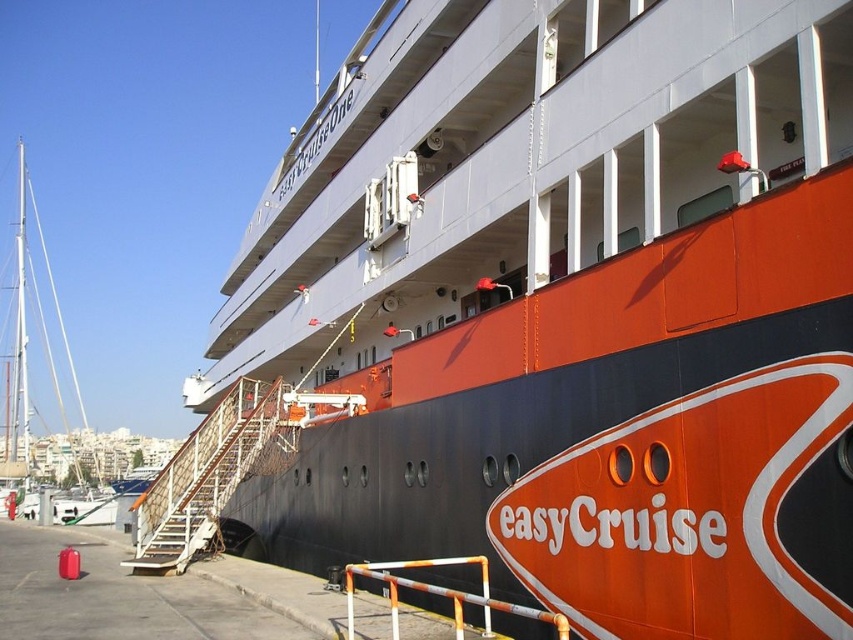
Question: Is white glossy sailboat at left closer to camera compared to orange/white metal railing at lower center?

Choices:
 (A) yes
 (B) no

Answer: (B)

Question: Estimate the real-world distances between objects in this image. Which object is farther from the white glossy sailboat at left?

Choices:
 (A) metallic stair rail at center
 (B) orange/white metal railing at lower center

Answer: (B)

Question: Which is nearer to the metallic stair rail at center?

Choices:
 (A) orange/white metal railing at lower center
 (B) white glossy sailboat at left

Answer: (A)

Question: Does metallic stair rail at center appear on the left side of orange/white metal railing at lower center?

Choices:
 (A) yes
 (B) no

Answer: (A)

Question: Which object is the farthest from the metallic stair rail at center?

Choices:
 (A) white glossy sailboat at left
 (B) orange/white metal railing at lower center

Answer: (A)

Question: Is metallic stair rail at center in front of orange/white metal railing at lower center?

Choices:
 (A) no
 (B) yes

Answer: (A)